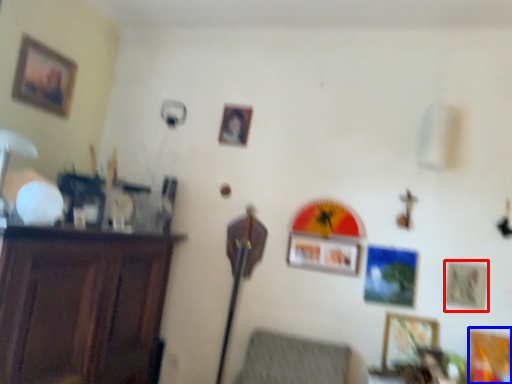
Question: Which of the following is the farthest to the observer, picture frame (highlighted by a red box) or picture frame (highlighted by a blue box)?

Choices:
 (A) picture frame
 (B) picture frame

Answer: (A)